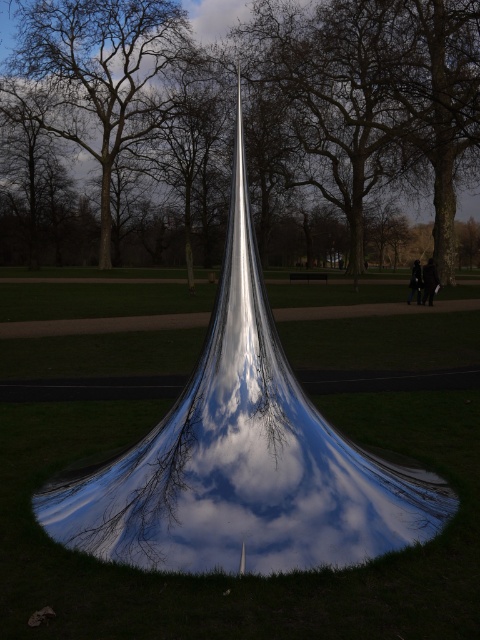
Question: Is smooth bark tree at center bigger than shiny metallic sculpture at center?

Choices:
 (A) yes
 (B) no

Answer: (A)

Question: Considering the real-world distances, which object is closest to the shiny metallic sculpture at center?

Choices:
 (A) smooth bark tree at center
 (B) brown bark tree at center

Answer: (A)

Question: Considering the real-world distances, which object is farthest from the shiny metallic sculpture at center?

Choices:
 (A) smooth bark tree at center
 (B) brown bark tree at center

Answer: (B)

Question: Does shiny metallic sculpture at center have a larger size compared to brown bark tree at center?

Choices:
 (A) no
 (B) yes

Answer: (A)

Question: Which of the following is the closest to the observer?

Choices:
 (A) brown bark tree at center
 (B) shiny metallic sculpture at center
 (C) smooth bark tree at center

Answer: (B)

Question: Can you confirm if smooth bark tree at center is bigger than brown bark tree at center?

Choices:
 (A) no
 (B) yes

Answer: (B)